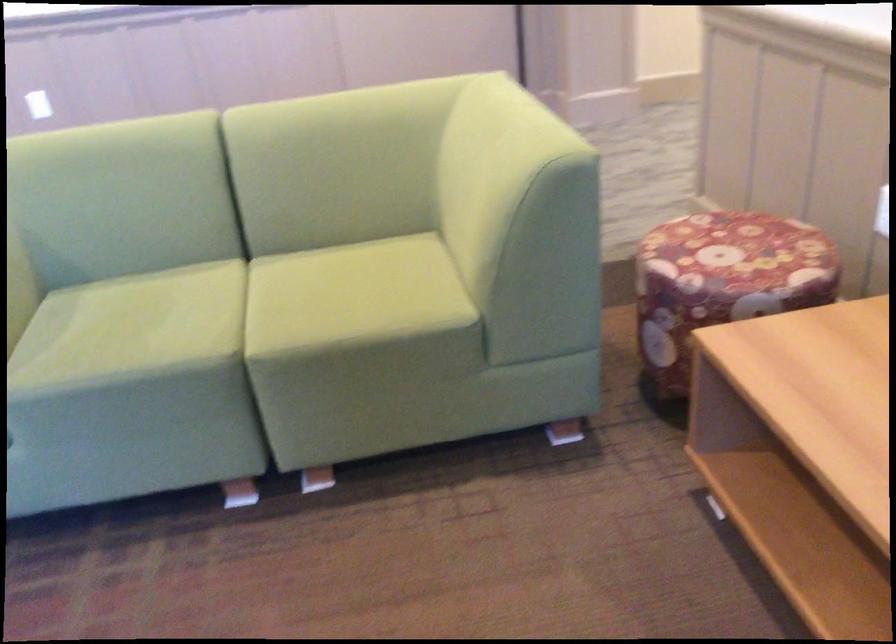
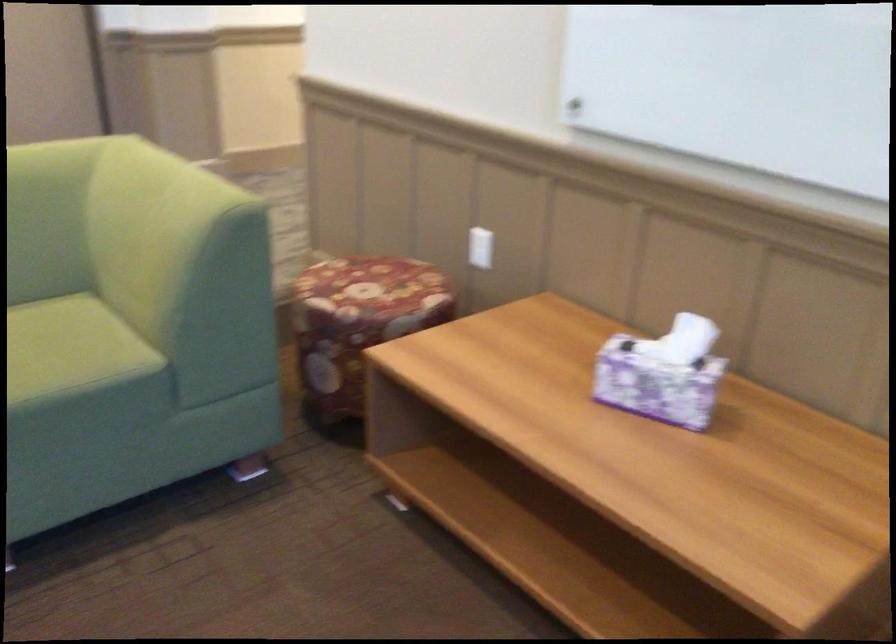
Locate, in the second image, the point that corresponds to (731,248) in the first image.

(372, 286)